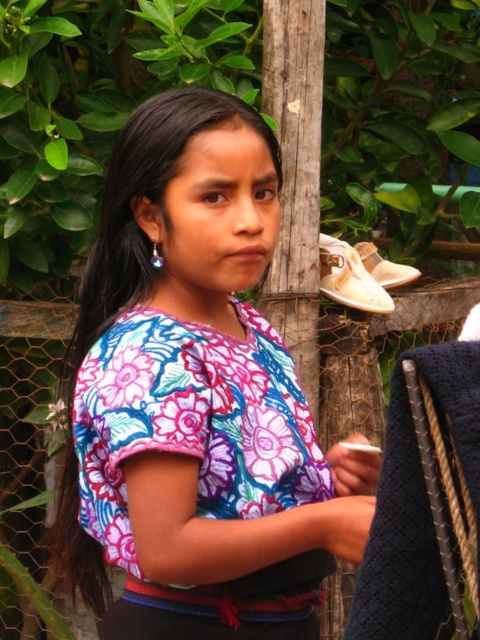
You are a photographer trying to capture the two points mentioned in the scene. Which point, point (137,577) or point (399,275), would appear larger in your photo?

Point (137,577) is closer to the viewer than point (399,275), so it would appear larger in the photo.